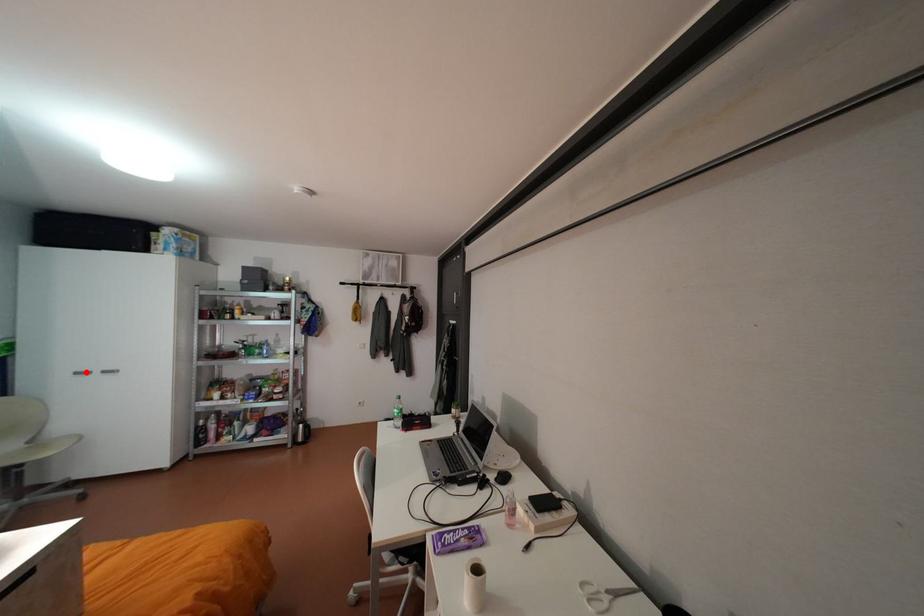
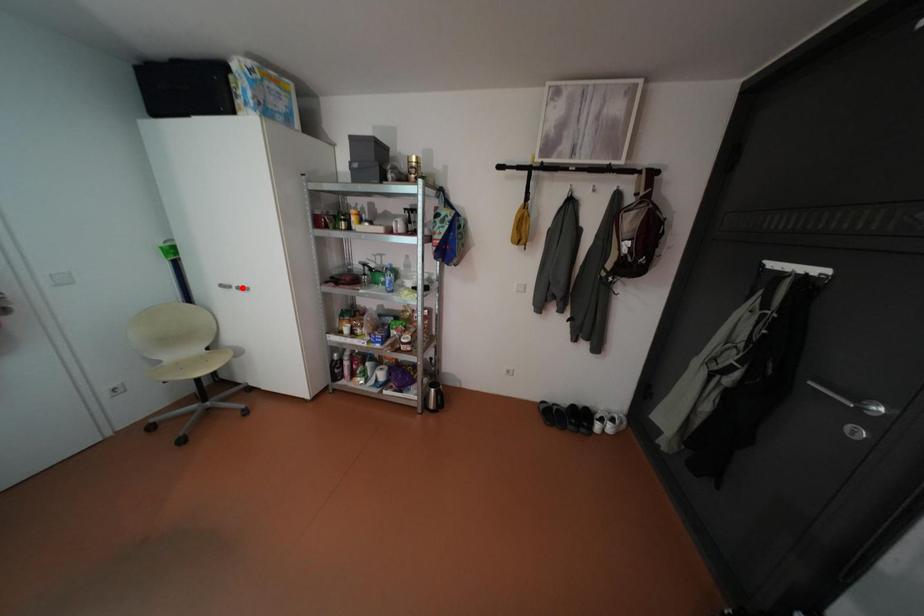
I am providing you with two images of the same scene from different viewpoints. A red point is marked on the first image and another point is marked on the second image. Is the red point in image1 aligned with the point shown in image2?

No